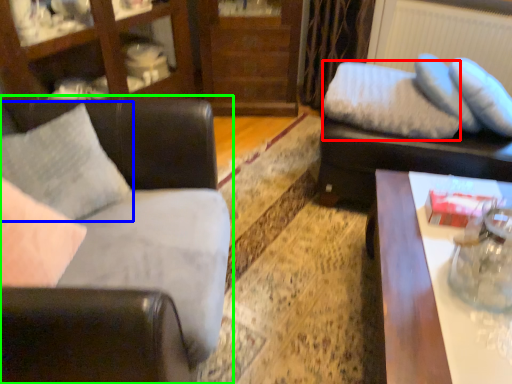
Question: Considering the real-world distances, which object is farthest from pillow (highlighted by a red box)? pillow (highlighted by a blue box) or studio couch (highlighted by a green box)?

Choices:
 (A) pillow
 (B) studio couch

Answer: (A)